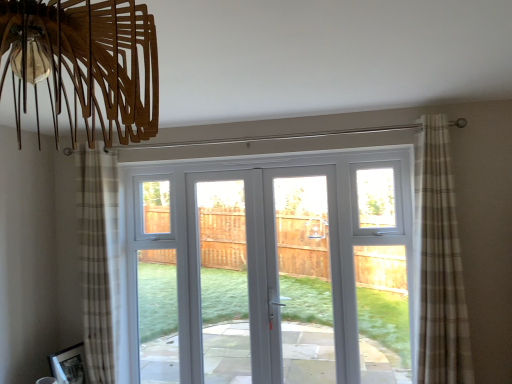
Question: Considering the positions of beige plaid curtain at left, the first curtain positioned from the left, and white glossy door at center in the image, is beige plaid curtain at left, the first curtain positioned from the left, taller or shorter than white glossy door at center?

Choices:
 (A) tall
 (B) short

Answer: (A)

Question: From the image's perspective, relative to white glossy door at center, is beige plaid curtain at left, the first curtain positioned from the left, above or below?

Choices:
 (A) above
 (B) below

Answer: (A)

Question: Based on their relative distances, which object is nearer to the beige plaid curtain at left, the 2th curtain viewed from the front?

Choices:
 (A) beige plaid curtain at right, which is counted as the first curtain, starting from the right
 (B) white glossy door at center

Answer: (A)

Question: Estimate the real-world distances between objects in this image. Which object is closer to the beige plaid curtain at left, the 1th curtain positioned from the back?

Choices:
 (A) beige plaid curtain at right, which is counted as the first curtain, starting from the right
 (B) white glossy door at center

Answer: (A)